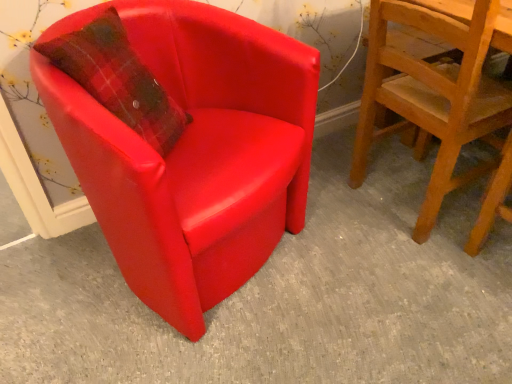
Question: Is matte red armchair at left, which ranks as the 1th chair in left-to-right order, smaller than wooden textured chair at right, the first chair in the right-to-left sequence?

Choices:
 (A) no
 (B) yes

Answer: (A)

Question: Is matte red armchair at left, the second chair positioned from the right, shorter than wooden textured chair at right, the second chair from the left?

Choices:
 (A) yes
 (B) no

Answer: (A)

Question: Can you confirm if matte red armchair at left, the second chair positioned from the right, is taller than wooden textured chair at right, the second chair from the left?

Choices:
 (A) no
 (B) yes

Answer: (A)

Question: Is matte red armchair at left, the second chair positioned from the right, further to the viewer compared to wooden textured chair at right, the first chair in the right-to-left sequence?

Choices:
 (A) yes
 (B) no

Answer: (B)

Question: From the image's perspective, is matte red armchair at left, which ranks as the 1th chair in left-to-right order, over wooden textured chair at right, the second chair from the left?

Choices:
 (A) yes
 (B) no

Answer: (B)

Question: Does matte red armchair at left, the second chair positioned from the right, have a lesser width compared to wooden textured chair at right, the second chair from the left?

Choices:
 (A) yes
 (B) no

Answer: (B)

Question: Does wooden textured chair at right, the second chair from the left, come behind matte red armchair at left, which ranks as the 1th chair in left-to-right order?

Choices:
 (A) yes
 (B) no

Answer: (A)

Question: From the image's perspective, does wooden textured chair at right, the first chair in the right-to-left sequence, appear higher than matte red armchair at left, which ranks as the 1th chair in left-to-right order?

Choices:
 (A) yes
 (B) no

Answer: (A)

Question: Can you confirm if wooden textured chair at right, the first chair in the right-to-left sequence, is wider than matte red armchair at left, the second chair positioned from the right?

Choices:
 (A) no
 (B) yes

Answer: (A)

Question: From a real-world perspective, is wooden textured chair at right, the first chair in the right-to-left sequence, positioned under matte red armchair at left, the second chair positioned from the right, based on gravity?

Choices:
 (A) yes
 (B) no

Answer: (B)

Question: From the image's perspective, is wooden textured chair at right, the second chair from the left, beneath matte red armchair at left, the second chair positioned from the right?

Choices:
 (A) yes
 (B) no

Answer: (B)

Question: Is wooden textured chair at right, the second chair from the left, not near matte red armchair at left, which ranks as the 1th chair in left-to-right order?

Choices:
 (A) no
 (B) yes

Answer: (A)

Question: Is matte red armchair at left, the second chair positioned from the right, spatially inside wooden textured chair at right, the first chair in the right-to-left sequence, or outside of it?

Choices:
 (A) inside
 (B) outside

Answer: (B)